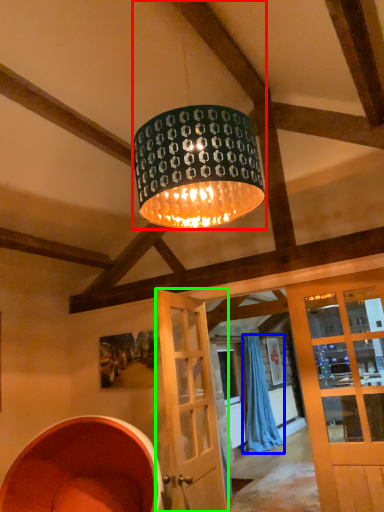
Question: Estimate the real-world distances between objects in this image. Which object is closer to lamp (highlighted by a red box), curtain (highlighted by a blue box) or door (highlighted by a green box)?

Choices:
 (A) curtain
 (B) door

Answer: (B)